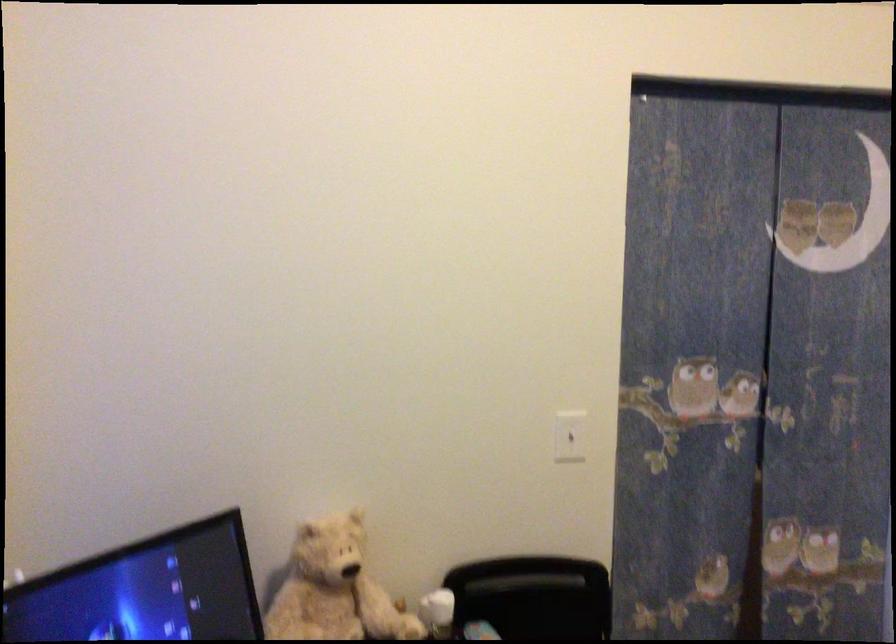
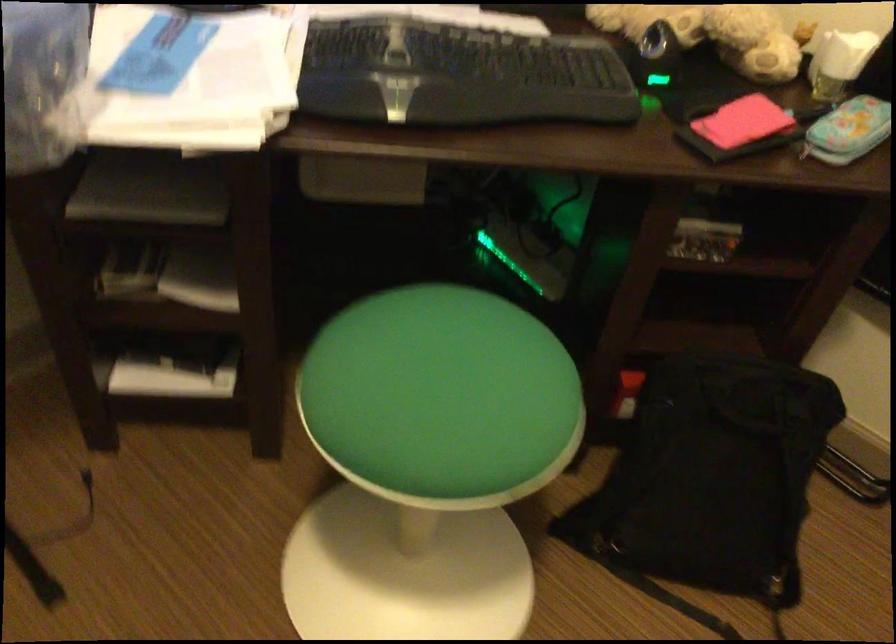
Based on the continuous images, in which direction is the camera rotating?

The rotation direction of the camera is left-down.